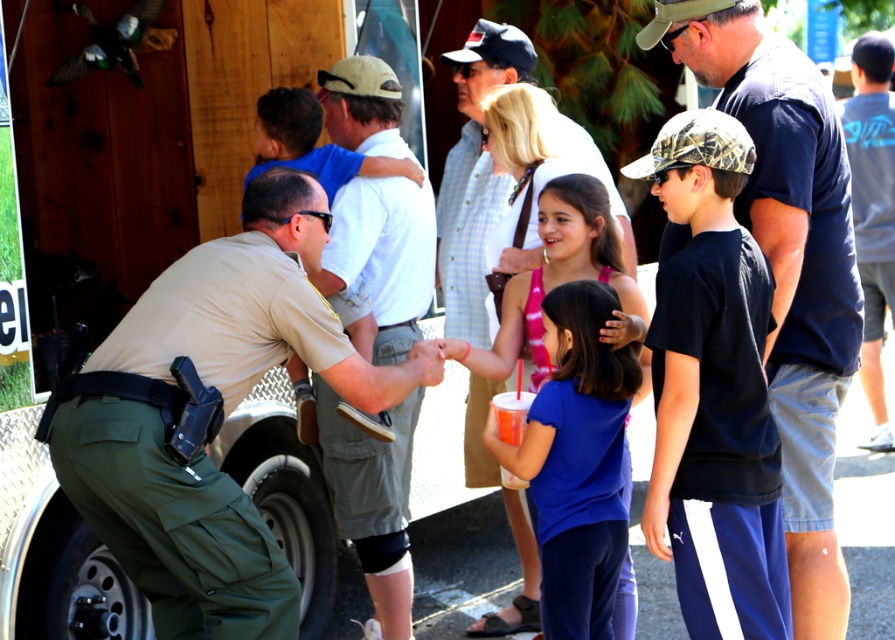
Question: Does tan uniform at center have a lesser width compared to dark blue t-shirt at center?

Choices:
 (A) yes
 (B) no

Answer: (B)

Question: Which of the following is the farthest from the observer?

Choices:
 (A) dark blue t-shirt at center
 (B) gray cotton t-shirt at right
 (C) khaki cotton shirt at center

Answer: (B)

Question: Can you confirm if tan uniform at center is smaller than gray cotton t-shirt at right?

Choices:
 (A) no
 (B) yes

Answer: (A)

Question: Which object is positioned farthest from the tan uniform at center?

Choices:
 (A) khaki cotton shirt at center
 (B) dark blue t-shirt at center

Answer: (B)

Question: Is dark blue t-shirt at center thinner than khaki cotton shirt at center?

Choices:
 (A) no
 (B) yes

Answer: (A)

Question: Based on their relative distances, which object is farther from the tan uniform at center?

Choices:
 (A) blue cotton shirt at center
 (B) khaki cotton shirt at center
 (C) gray cotton t-shirt at right
 (D) dark blue t-shirt at center

Answer: (C)